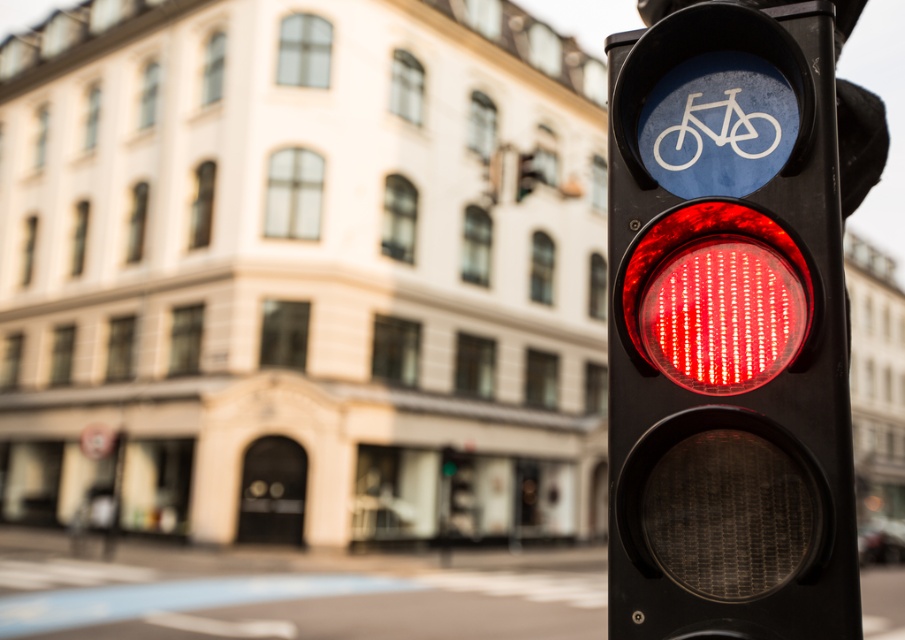
Does point (738, 348) come farther from viewer compared to point (730, 109)?

No, it is in front of (730, 109).

Who is positioned more to the left, matte black traffic light at right or white plastic bicycle at upper center?

matte black traffic light at right

Between point (693, 16) and point (696, 140), which one is positioned in front?

Point (693, 16) is in front.

The image size is (905, 640). Identify the location of matte black traffic light at right. (730, 355).